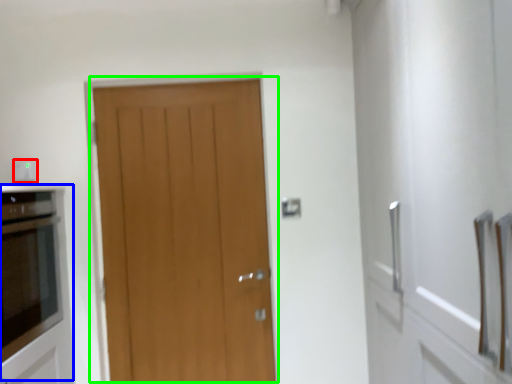
Question: Which is nearer to the electric outlet (highlighted by a red box)? appliance (highlighted by a blue box) or door (highlighted by a green box).

Choices:
 (A) appliance
 (B) door

Answer: (A)